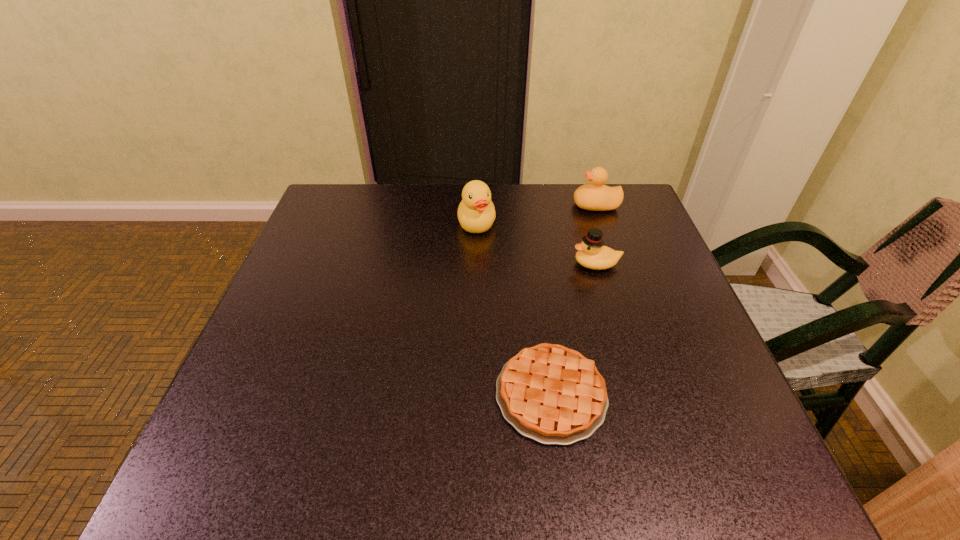
This screenshot has height=540, width=960. Find the location of `vacant area between the second nearest object and the pie`. vacant area between the second nearest object and the pie is located at coordinates (574, 329).

What are the coordinates of `vacant space in between the leftmost duck and the nearest duck` in the screenshot? It's located at [537, 244].

Point out which object is positioned as the nearest to the leftmost duck. Please provide its 2D coordinates. Your answer should be formatted as a tuple, i.e. [(x, y)], where the tuple contains the x and y coordinates of a point satisfying the conditions above.

[(592, 254)]

Point out which object is positioned as the third nearest to the shortest object. Please provide its 2D coordinates. Your answer should be formatted as a tuple, i.e. [(x, y)], where the tuple contains the x and y coordinates of a point satisfying the conditions above.

[(595, 196)]

Where is `duck that is the third closest to the pie`? duck that is the third closest to the pie is located at coordinates (595, 196).

Select which duck appears as the second closest to the nearest object. Please provide its 2D coordinates. Your answer should be formatted as a tuple, i.e. [(x, y)], where the tuple contains the x and y coordinates of a point satisfying the conditions above.

[(476, 213)]

The height and width of the screenshot is (540, 960). I want to click on free spot that satisfies the following two spatial constraints: 1. on the front-facing side of the second nearest object; 2. on the front side of the pie, so click(x=635, y=394).